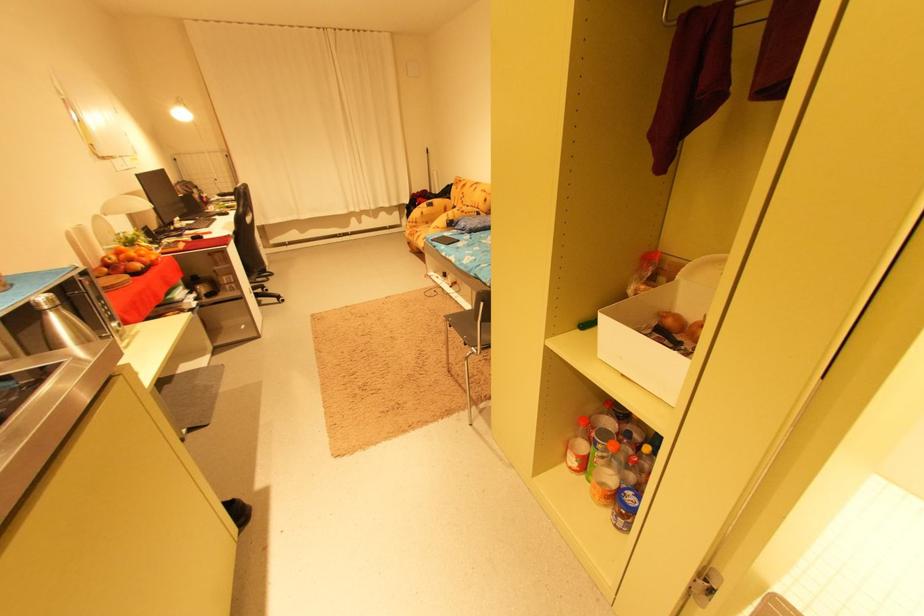
I want to click on metal cabinet latch, so click(704, 586).